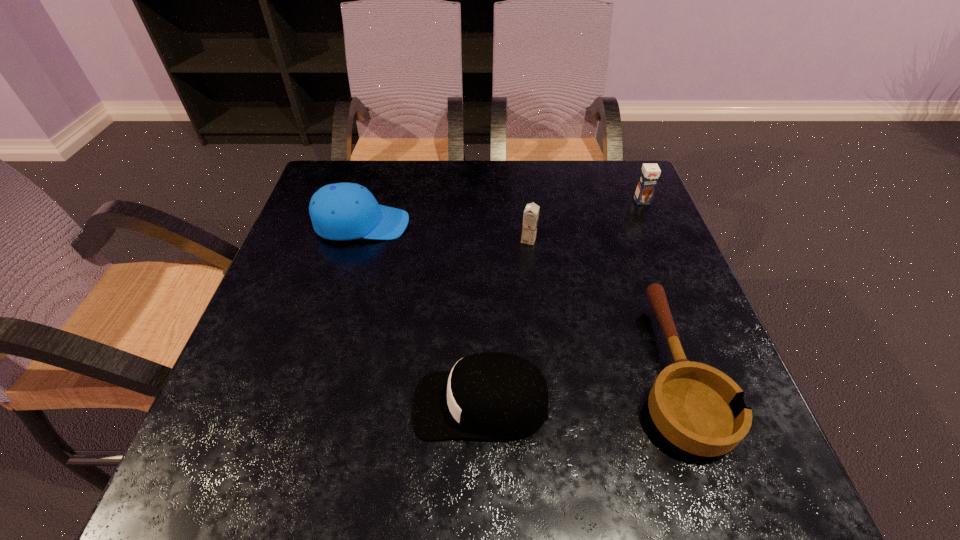
Locate an element on the screen. object that is positioned at the left edge is located at coordinates (342, 211).

The width and height of the screenshot is (960, 540). In order to click on chocolate milk situated at the right edge in this screenshot , I will do `click(649, 175)`.

The image size is (960, 540). Identify the location of saucepan situated at the right edge. (698, 408).

You are a GUI agent. You are given a task and a screenshot of the screen. Output one action in this format:
    pyautogui.click(x=<x>, y=<y>)
    Task: Click on the object that is at the far left corner
    The width and height of the screenshot is (960, 540).
    Given the screenshot: What is the action you would take?
    pyautogui.click(x=342, y=211)

Where is `object situated at the far right corner`? object situated at the far right corner is located at coordinates (649, 175).

Find the location of a particular element. The height and width of the screenshot is (540, 960). object located in the near right corner section of the desktop is located at coordinates (698, 408).

The image size is (960, 540). I want to click on free region at the far edge of the desktop, so click(512, 177).

Image resolution: width=960 pixels, height=540 pixels. What are the coordinates of `free location at the near edge` in the screenshot? It's located at (535, 486).

Identify the location of free region at the left edge of the desktop. The height and width of the screenshot is (540, 960). (254, 366).

In the image, there is a desktop. At what (x,y) coordinates should I click in order to perform the action: click on vacant space at the right edge. Please return your answer as a coordinate pair (x, y). The height and width of the screenshot is (540, 960). Looking at the image, I should click on point(616,287).